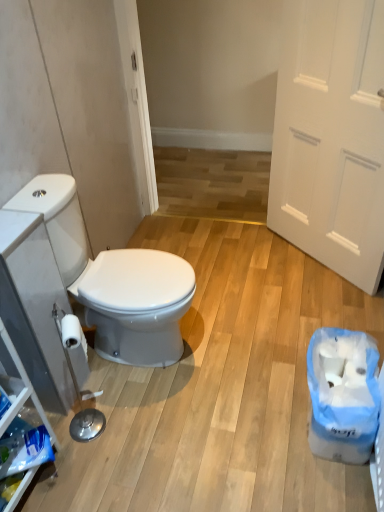
Identify the location of vacant space in front of white glossy toilet seat at left. (143, 433).